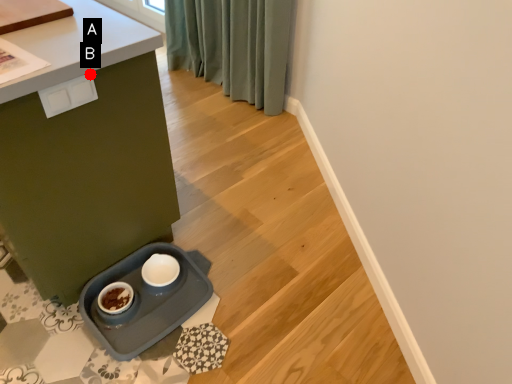
Question: Two points are circled on the image, labeled by A and B beside each circle. Which point is closer to the camera?

Choices:
 (A) A is closer
 (B) B is closer

Answer: (B)